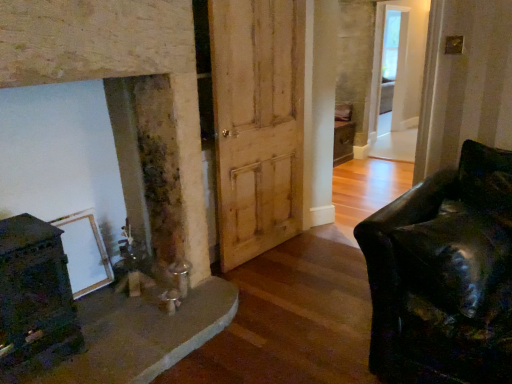
Where is `natural wood barn door at center`? This screenshot has height=384, width=512. natural wood barn door at center is located at coordinates (257, 123).

What do you see at coordinates (257, 123) in the screenshot?
I see `natural wood barn door at center` at bounding box center [257, 123].

Identify the location of clear glass door at upper right. The height and width of the screenshot is (384, 512). (399, 79).

This screenshot has height=384, width=512. What do you see at coordinates (399, 79) in the screenshot?
I see `clear glass door at upper right` at bounding box center [399, 79].

At what (x,y) coordinates should I click in order to perform the action: click on natural wood barn door at center. Please return your answer as a coordinate pair (x, y). This screenshot has height=384, width=512. Looking at the image, I should click on (257, 123).

Which is more to the left, clear glass door at upper right or natural wood barn door at center?

natural wood barn door at center is more to the left.

Which object is closer to the camera taking this photo, clear glass door at upper right or natural wood barn door at center?

natural wood barn door at center is more forward.

Which is nearer, (399,71) or (243,123)?

Point (399,71) is positioned farther from the camera compared to point (243,123).

From the image's perspective, is clear glass door at upper right positioned above or below natural wood barn door at center?

clear glass door at upper right is above natural wood barn door at center.

From a real-world perspective, between clear glass door at upper right and natural wood barn door at center, who is vertically higher?

In real-world perspective, clear glass door at upper right is above.

Which of these two, clear glass door at upper right or natural wood barn door at center, is wider?

clear glass door at upper right is wider.

Considering the relative sizes of clear glass door at upper right and natural wood barn door at center in the image provided, is clear glass door at upper right taller than natural wood barn door at center?

Yes, clear glass door at upper right is taller than natural wood barn door at center.

Considering the sizes of clear glass door at upper right and natural wood barn door at center in the image, is clear glass door at upper right bigger or smaller than natural wood barn door at center?

Considering their sizes, clear glass door at upper right takes up more space than natural wood barn door at center.

Do you think clear glass door at upper right is within natural wood barn door at center, or outside of it?

clear glass door at upper right lies outside natural wood barn door at center.

In the scene shown: Is clear glass door at upper right next to natural wood barn door at center and touching it?

No, clear glass door at upper right is not in contact with natural wood barn door at center.

Is clear glass door at upper right facing away from natural wood barn door at center?

No, clear glass door at upper right is not facing away from natural wood barn door at center.

How many degrees apart are the facing directions of clear glass door at upper right and natural wood barn door at center?

The angular difference between clear glass door at upper right and natural wood barn door at center is 5.27 degrees.

How far apart are clear glass door at upper right and natural wood barn door at center?

clear glass door at upper right is 14.83 feet from natural wood barn door at center.

This screenshot has height=384, width=512. In the image, there is a natural wood barn door at center. Identify the location of glass door above it (from the image's perspective). (399, 79).

Is natural wood barn door at center at the left side of clear glass door at upper right?

Yes, natural wood barn door at center is to the left of clear glass door at upper right.

Does natural wood barn door at center come in front of clear glass door at upper right?

Yes.

Between point (260, 57) and point (389, 13), which one is positioned behind?

The point (389, 13) is more distant.

From the image's perspective, between natural wood barn door at center and clear glass door at upper right, which one is located above?

clear glass door at upper right, from the image's perspective.

From a real-world perspective, which is physically below, natural wood barn door at center or clear glass door at upper right?

natural wood barn door at center, from a real-world perspective.

Considering the relative sizes of natural wood barn door at center and clear glass door at upper right in the image provided, is natural wood barn door at center thinner than clear glass door at upper right?

Yes.

Considering the sizes of natural wood barn door at center and clear glass door at upper right in the image, is natural wood barn door at center taller or shorter than clear glass door at upper right?

Considering their sizes, natural wood barn door at center has less height than clear glass door at upper right.

Is natural wood barn door at center smaller than clear glass door at upper right?

Correct, natural wood barn door at center occupies less space than clear glass door at upper right.

Do you think natural wood barn door at center is within clear glass door at upper right, or outside of it?

natural wood barn door at center is not inside clear glass door at upper right, it's outside.

Is natural wood barn door at center not near clear glass door at upper right?

That's right, there is a large distance between natural wood barn door at center and clear glass door at upper right.

Is clear glass door at upper right at the back of natural wood barn door at center?

No.

From the picture: Measure the distance between natural wood barn door at center and clear glass door at upper right.

natural wood barn door at center is 4.52 meters away from clear glass door at upper right.

Where is `barn door that is under the clear glass door at upper right (from a real-world perspective)`? barn door that is under the clear glass door at upper right (from a real-world perspective) is located at coordinates (257, 123).

There is a natural wood barn door at center. At what (x,y) coordinates should I click in order to perform the action: click on glass door above it (from a real-world perspective). Please return your answer as a coordinate pair (x, y). Looking at the image, I should click on (399, 79).

Find the location of a particular element. This screenshot has height=384, width=512. glass door on the right of the natural wood barn door at center is located at coordinates (399, 79).